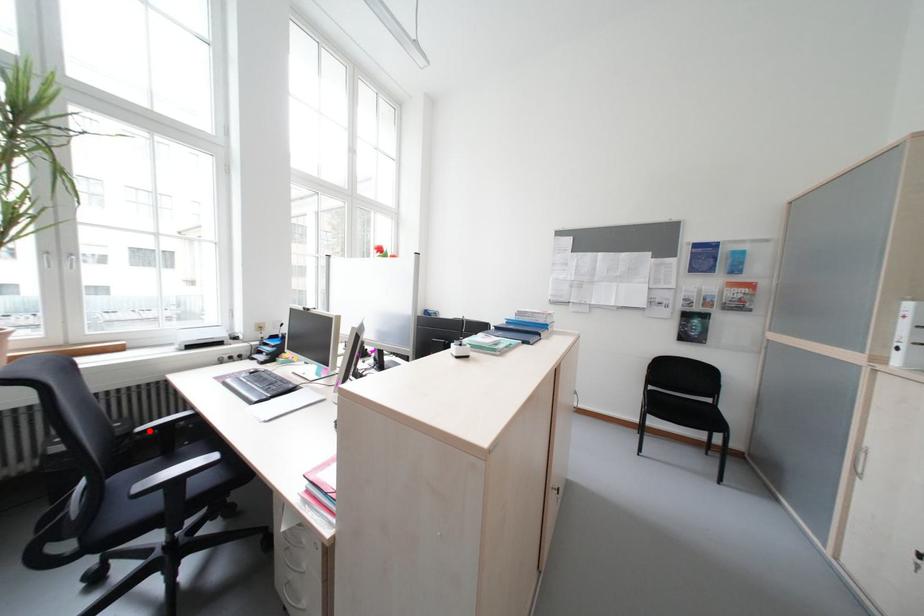
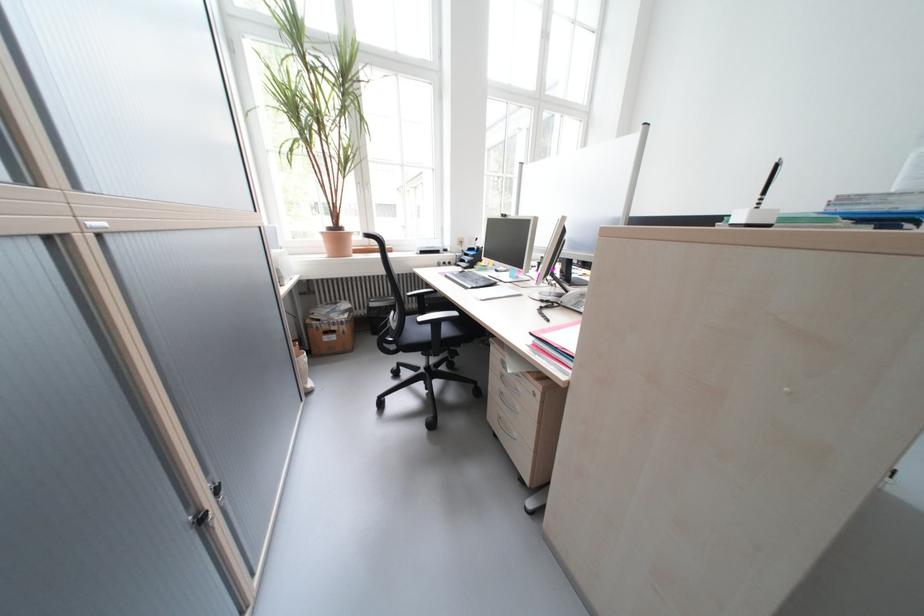
Where in the second image is the point corresponding to the highlighted location from the first image?

(419, 294)